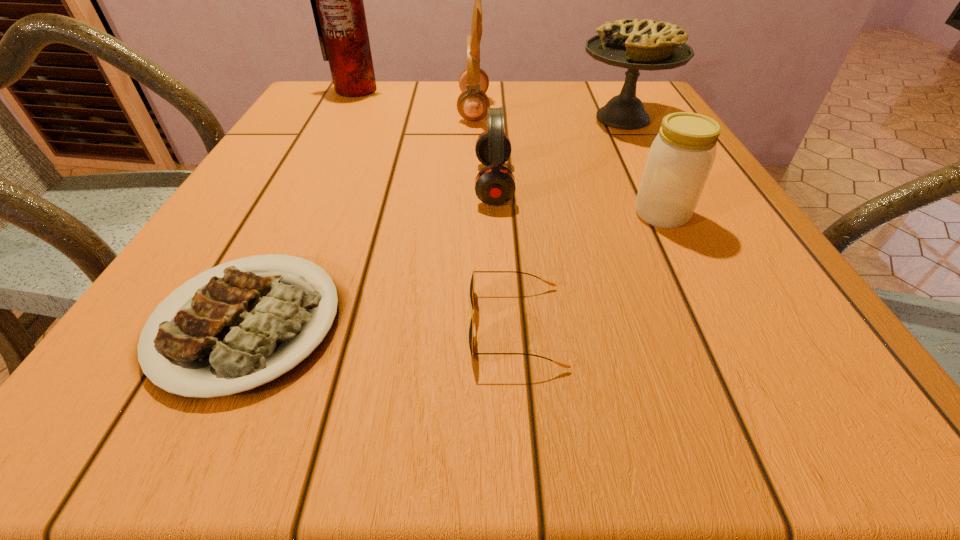
At what (x,y) coordinates should I click in order to perform the action: click on vacant space situated 0.400m on the front-facing side of the sixth tallest object. Please return your answer as a coordinate pair (x, y). Looking at the image, I should click on (169, 326).

Find the location of a particular element. This screenshot has height=540, width=960. free space located 0.340m on the right of the shortest object is located at coordinates (605, 324).

In order to click on fire extinguisher located at the far edge in this screenshot , I will do `click(337, 3)`.

Locate an element on the screen. earphone that is positioned at the far edge is located at coordinates (472, 103).

The height and width of the screenshot is (540, 960). What are the coordinates of `pie at the far edge` in the screenshot? It's located at (636, 44).

The height and width of the screenshot is (540, 960). In order to click on sunglasses that is at the near edge in this screenshot , I will do `click(471, 339)`.

At what (x,y) coordinates should I click in order to perform the action: click on plate at the near edge. Please return your answer as a coordinate pair (x, y). The width and height of the screenshot is (960, 540). Looking at the image, I should click on (244, 333).

The width and height of the screenshot is (960, 540). Find the location of `fire extinguisher at the left edge`. fire extinguisher at the left edge is located at coordinates (337, 3).

Identify the location of plate positioned at the left edge. The height and width of the screenshot is (540, 960). (244, 333).

Identify the location of pie present at the right edge. Image resolution: width=960 pixels, height=540 pixels. (636, 44).